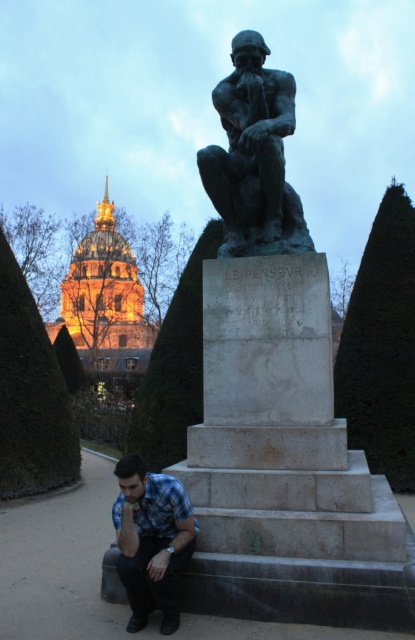
Question: Which is farther from the green leafy hedge at left?

Choices:
 (A) blue plaid shirt at lower left
 (B) green leafy hedge at center

Answer: (A)

Question: Can you confirm if green leafy hedge at left is positioned below green leafy hedge at center?

Choices:
 (A) no
 (B) yes

Answer: (A)

Question: From the image, what is the correct spatial relationship of green leafy hedge at left in relation to green leafy hedge at center?

Choices:
 (A) right
 (B) left

Answer: (B)

Question: Which object is farther from the camera taking this photo?

Choices:
 (A) blue plaid shirt at lower left
 (B) dark green hedge at right

Answer: (B)

Question: Estimate the real-world distances between objects in this image. Which object is farther from the bronze statue at center?

Choices:
 (A) dark green hedge at right
 (B) green leafy hedge at center

Answer: (A)

Question: Considering the relative positions of dark green hedge at right and blue plaid shirt at lower left in the image provided, where is dark green hedge at right located with respect to blue plaid shirt at lower left?

Choices:
 (A) below
 (B) above

Answer: (B)